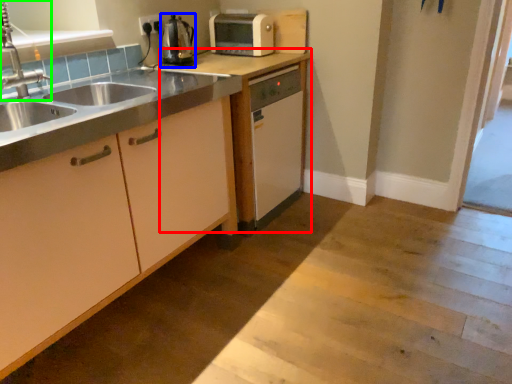
Question: Based on their relative distances, which object is nearer to cabinetry (highlighted by a red box)? Choose from kitchen appliance (highlighted by a blue box) and tap (highlighted by a green box).

Choices:
 (A) kitchen appliance
 (B) tap

Answer: (A)